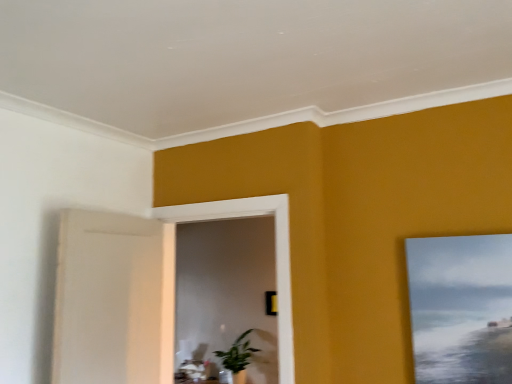
Question: Is the depth of matte canvas painting at upper right greater than that of green glossy plant at center?

Choices:
 (A) yes
 (B) no

Answer: (B)

Question: From the image's perspective, is matte canvas painting at upper right located above green glossy plant at center?

Choices:
 (A) no
 (B) yes

Answer: (B)

Question: From the image's perspective, is matte canvas painting at upper right under green glossy plant at center?

Choices:
 (A) no
 (B) yes

Answer: (A)

Question: Can you confirm if matte canvas painting at upper right is positioned to the left of green glossy plant at center?

Choices:
 (A) no
 (B) yes

Answer: (A)

Question: Can you confirm if matte canvas painting at upper right is thinner than green glossy plant at center?

Choices:
 (A) no
 (B) yes

Answer: (B)

Question: Considering the relative positions of matte canvas painting at upper right and green glossy plant at center in the image provided, is matte canvas painting at upper right in front of green glossy plant at center?

Choices:
 (A) yes
 (B) no

Answer: (A)

Question: Can you confirm if green glossy plant at center is wider than white wooden frame at center?

Choices:
 (A) no
 (B) yes

Answer: (B)

Question: Is green glossy plant at center positioned far away from white wooden frame at center?

Choices:
 (A) no
 (B) yes

Answer: (B)

Question: Does green glossy plant at center contain white wooden frame at center?

Choices:
 (A) no
 (B) yes

Answer: (A)

Question: Does green glossy plant at center have a smaller size compared to white wooden frame at center?

Choices:
 (A) no
 (B) yes

Answer: (B)

Question: From the image's perspective, is green glossy plant at center under white wooden frame at center?

Choices:
 (A) yes
 (B) no

Answer: (A)

Question: Considering the relative positions of green glossy plant at center and white wooden frame at center in the image provided, is green glossy plant at center to the left of white wooden frame at center from the viewer's perspective?

Choices:
 (A) yes
 (B) no

Answer: (B)

Question: Is white wooden frame at center outside green glossy plant at center?

Choices:
 (A) no
 (B) yes

Answer: (B)